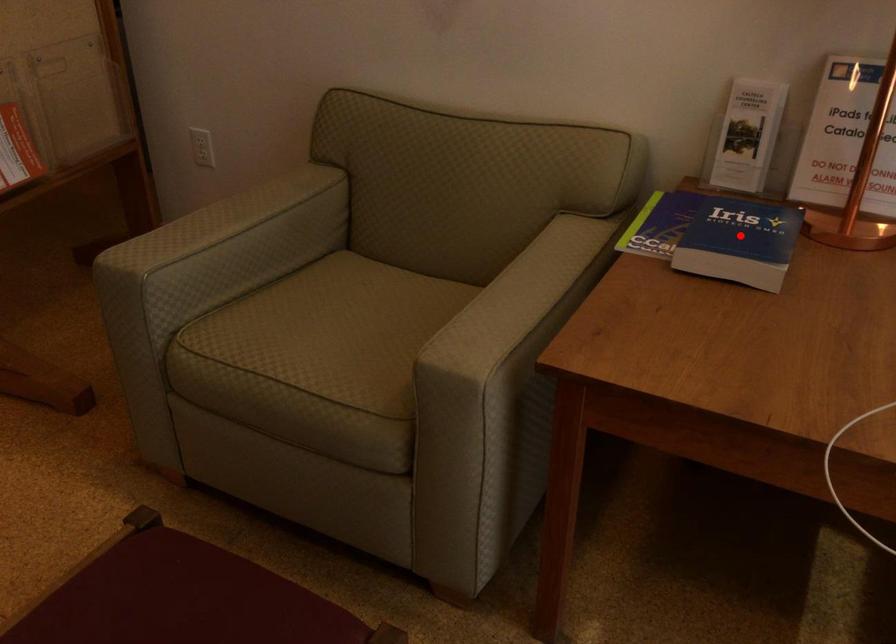
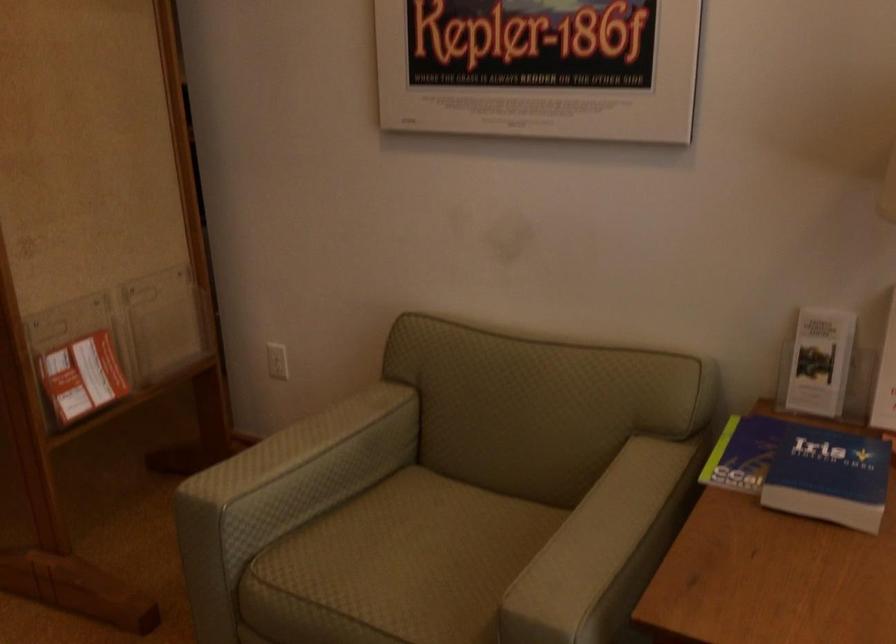
Where in the second image is the point corresponding to the highlighted location from the first image?

(829, 476)